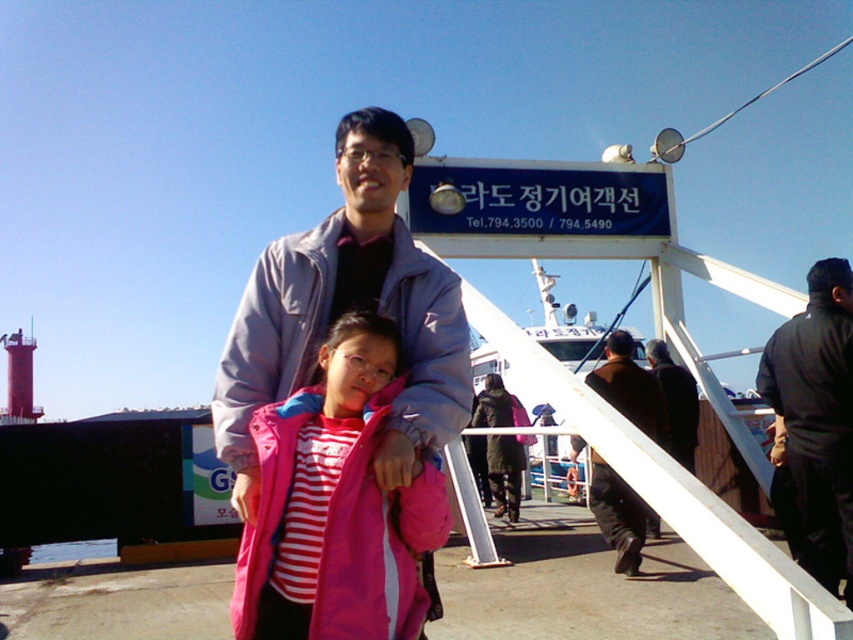
You are standing at the ferry terminal and see the blue plastic sign at upper center. The man and the young girl are also present. If you want to read the sign clearly, should you move closer to the man and young girl or move away from them?

You should move closer to the man and young girl because the blue plastic sign at upper center is 16.93 meters away from them, so moving closer to them would bring you nearer to the sign for better visibility.

What is the spatial relationship between the blue plastic sign at upper center and the dark green coat at center?

The blue plastic sign at upper center is located to the right of the dark green coat at center.